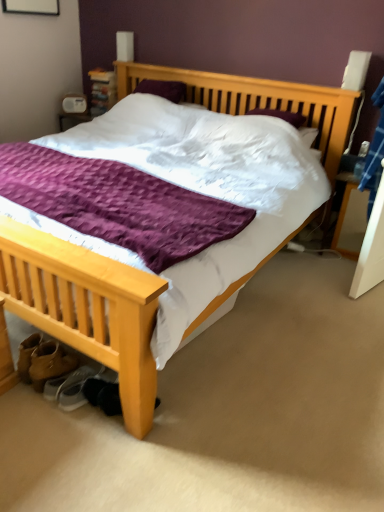
Question: From a real-world perspective, is light wood bed at center beneath leather tan boot at lower left?

Choices:
 (A) yes
 (B) no

Answer: (B)

Question: Considering the relative positions of light wood bed at center and leather tan boot at lower left in the image provided, is light wood bed at center to the left of leather tan boot at lower left from the viewer's perspective?

Choices:
 (A) yes
 (B) no

Answer: (B)

Question: Are light wood bed at center and leather tan boot at lower left located far from each other?

Choices:
 (A) yes
 (B) no

Answer: (A)

Question: Does light wood bed at center lie behind leather tan boot at lower left?

Choices:
 (A) no
 (B) yes

Answer: (A)

Question: Is light wood bed at center at the right side of leather tan boot at lower left?

Choices:
 (A) no
 (B) yes

Answer: (B)

Question: Is light wood bed at center surrounding leather tan boot at lower left?

Choices:
 (A) no
 (B) yes

Answer: (B)

Question: Considering the relative sizes of light wood bed at center and black suede shoe at lower left, which appears as the second shoe when viewed from the left, in the image provided, is light wood bed at center taller than black suede shoe at lower left, which appears as the second shoe when viewed from the left,?

Choices:
 (A) no
 (B) yes

Answer: (B)

Question: Does light wood bed at center appear on the right side of black suede shoe at lower left, which is the 1th shoe from right to left?

Choices:
 (A) no
 (B) yes

Answer: (A)

Question: Would you say light wood bed at center is outside black suede shoe at lower left, which appears as the second shoe when viewed from the left?

Choices:
 (A) yes
 (B) no

Answer: (A)

Question: Would you say light wood bed at center is a long distance from black suede shoe at lower left, which appears as the second shoe when viewed from the left?

Choices:
 (A) no
 (B) yes

Answer: (B)

Question: Is black suede shoe at lower left, which is the 1th shoe from right to left, a part of light wood bed at center?

Choices:
 (A) no
 (B) yes

Answer: (B)

Question: Can you confirm if light wood bed at center is bigger than black suede shoe at lower left, which is the 1th shoe from right to left?

Choices:
 (A) yes
 (B) no

Answer: (A)

Question: Can you confirm if wooden nightstand at right is thinner than light wood bed at center?

Choices:
 (A) no
 (B) yes

Answer: (B)